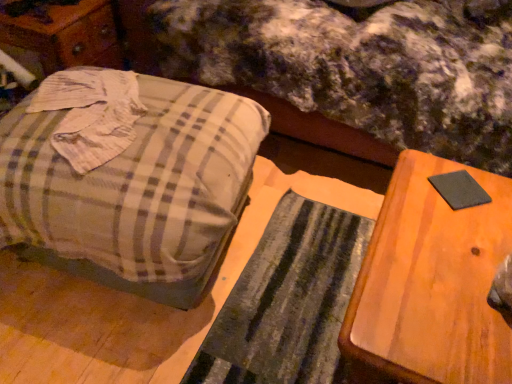
Question: Does wooden table at right have a greater height compared to wooden dresser at left?

Choices:
 (A) yes
 (B) no

Answer: (A)

Question: Is wooden dresser at left surrounded by wooden table at right?

Choices:
 (A) no
 (B) yes

Answer: (A)

Question: Is wooden table at right turned away from wooden dresser at left?

Choices:
 (A) yes
 (B) no

Answer: (B)

Question: Considering the relative positions of wooden table at right and wooden dresser at left in the image provided, is wooden table at right in front of wooden dresser at left?

Choices:
 (A) no
 (B) yes

Answer: (B)

Question: From the image's perspective, would you say wooden table at right is positioned over wooden dresser at left?

Choices:
 (A) no
 (B) yes

Answer: (A)

Question: Can you confirm if wooden table at right is wider than wooden dresser at left?

Choices:
 (A) no
 (B) yes

Answer: (B)

Question: Is plaid fabric suitcase at left positioned in front of plaid fabric mattress at center?

Choices:
 (A) no
 (B) yes

Answer: (B)

Question: From the image's perspective, would you say plaid fabric suitcase at left is shown under plaid fabric mattress at center?

Choices:
 (A) yes
 (B) no

Answer: (A)

Question: Can you confirm if plaid fabric suitcase at left is taller than plaid fabric mattress at center?

Choices:
 (A) no
 (B) yes

Answer: (A)

Question: Can you confirm if plaid fabric suitcase at left is positioned to the left of plaid fabric mattress at center?

Choices:
 (A) yes
 (B) no

Answer: (A)

Question: Would you say plaid fabric suitcase at left is outside plaid fabric mattress at center?

Choices:
 (A) no
 (B) yes

Answer: (B)

Question: From a real-world perspective, is plaid fabric suitcase at left beneath plaid fabric mattress at center?

Choices:
 (A) yes
 (B) no

Answer: (A)

Question: Considering the relative sizes of plaid fabric mattress at center and black felt pad at right in the image provided, is plaid fabric mattress at center bigger than black felt pad at right?

Choices:
 (A) no
 (B) yes

Answer: (B)